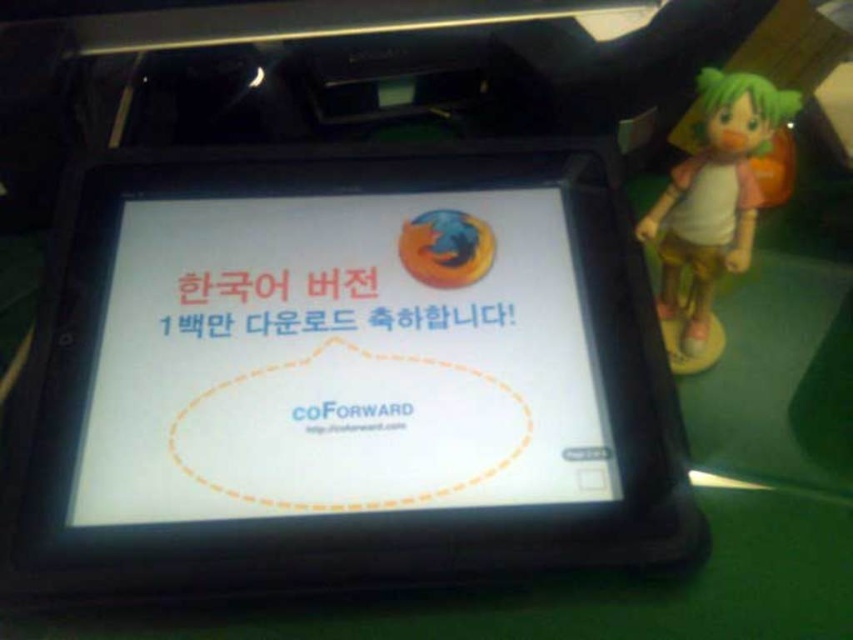
Can you confirm if white glossy screen at center is smaller than green matte figure at right?

No, white glossy screen at center is not smaller than green matte figure at right.

You are a GUI agent. You are given a task and a screenshot of the screen. Output one action in this format:
    pyautogui.click(x=<x>, y=<y>)
    Task: Click on the white glossy screen at center
    The width and height of the screenshot is (853, 640).
    Given the screenshot: What is the action you would take?
    pyautogui.click(x=341, y=360)